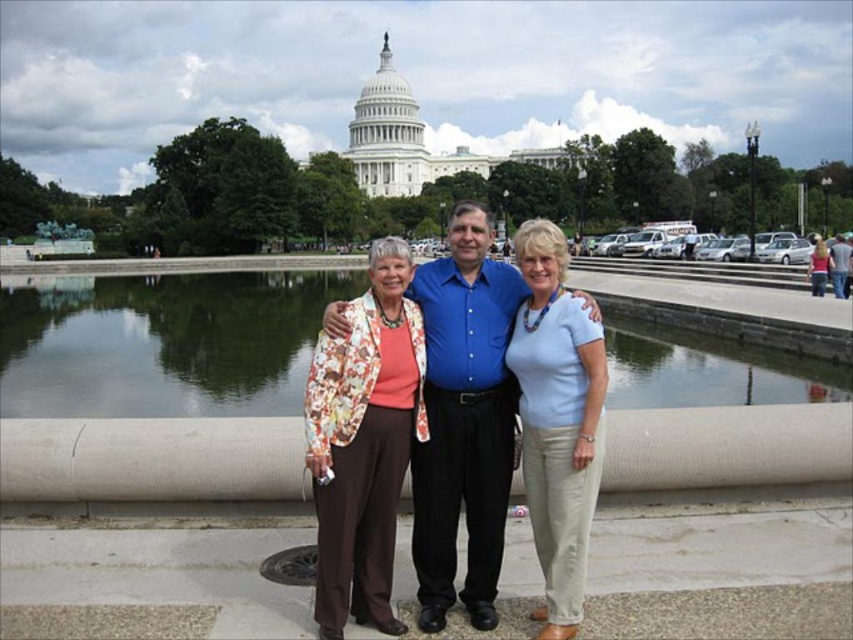
You are standing at the point marked by the coordinates point (x=161, y=342) in the image. Looking around, you see the United States Capitol building in the background and a reflective water feature nearby. Which direction should you walk to reach the Capitol building?

The transparent glass water at center is represented by point (x=161, y=342). Since the Capitol building is in the background, you should walk away from the water feature towards the direction of the Capitol building to reach it.